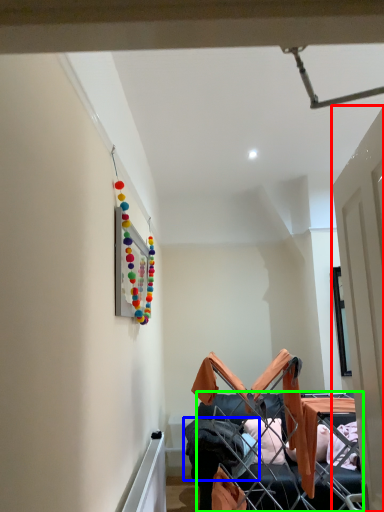
Question: Which object is positioned farthest from door (highlighted by a red box)? Select from clothing (highlighted by a blue box) and furniture (highlighted by a green box).

Choices:
 (A) clothing
 (B) furniture

Answer: (A)